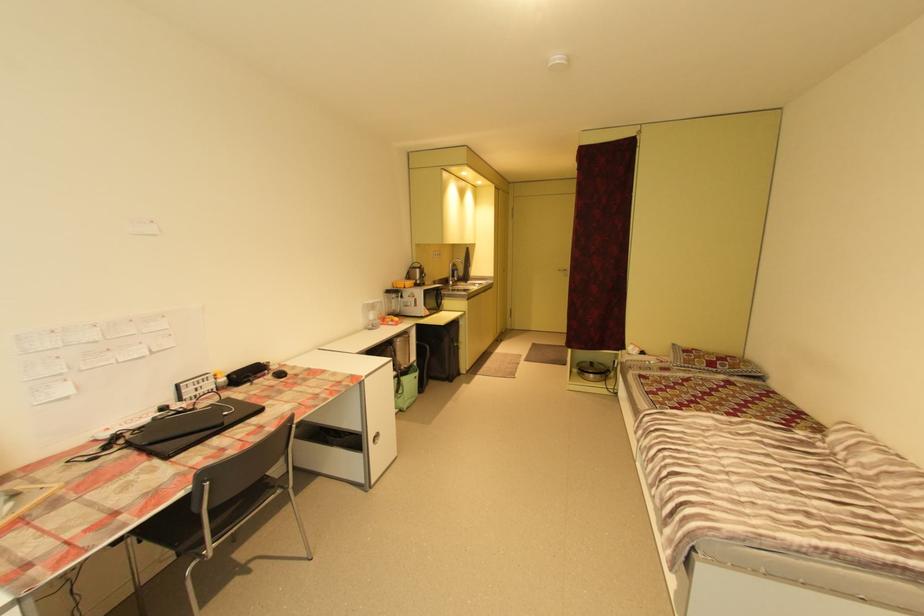
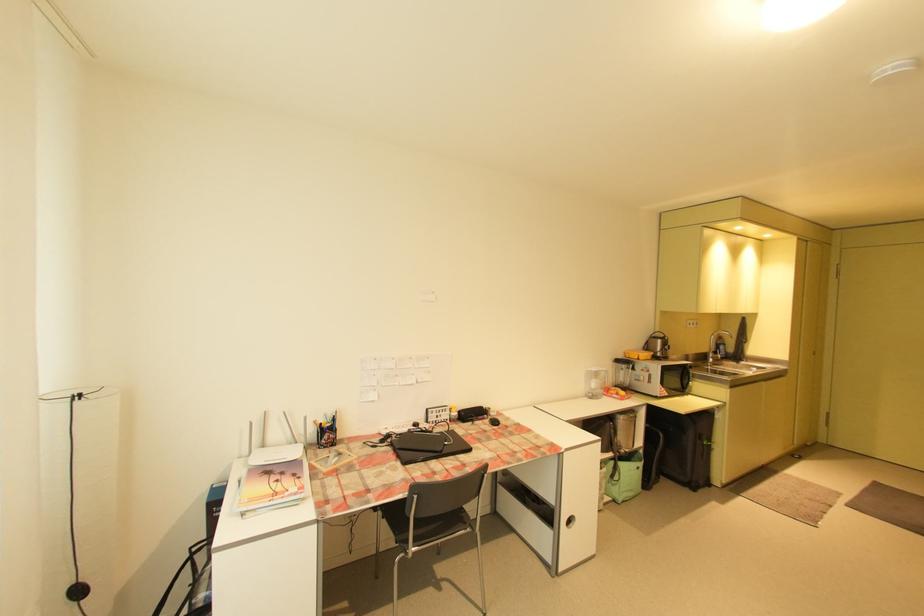
In the second image, find the point that corresponds to (x=387, y=302) in the first image.

(613, 371)